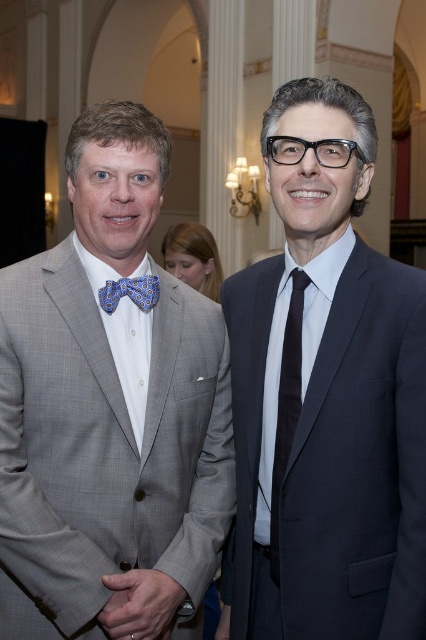
You are a photographer at a formal event. You need to place a small microphone stand at point (287, 408). However, there is already an object there. What object is blocking the placement of the microphone stand?

The black silk tie at center is located at point (287, 408), so the microphone stand cannot be placed there because the black silk tie at center is already occupying that position.